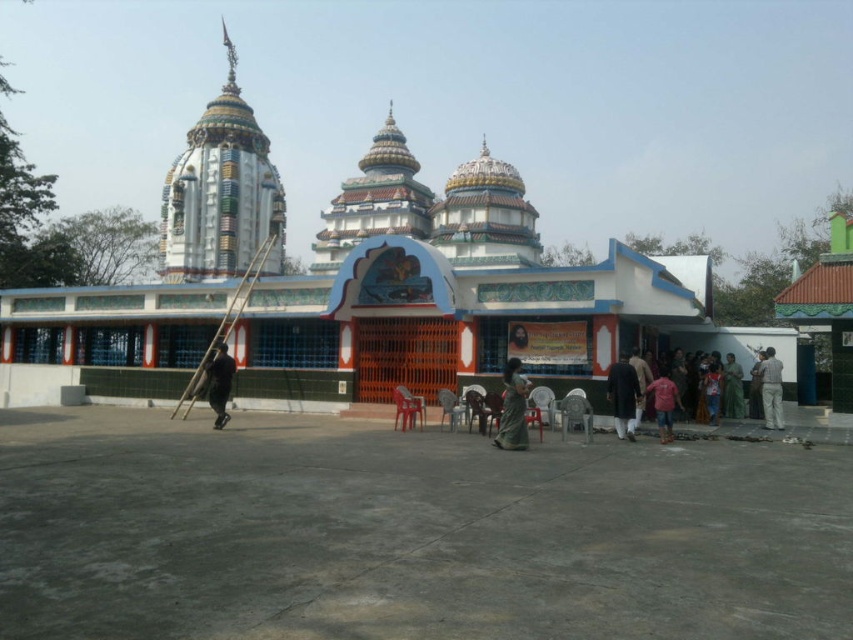
You are a visitor at the temple complex and notice two fabrics displayed in the courtyard. The dark brown fabric at center and the dark blue fabric at center. Which fabric is positioned lower in relation to the other?

The dark brown fabric at center is below dark blue fabric at center, so the dark brown fabric at center is positioned lower than the dark blue fabric at center.

You are standing in the courtyard of the temple complex and want to place a new decorative item. The temple has a large arched gateway with a painted mural above it. There are several plastic chairs arranged in the courtyard. Where should you place the new item so it aligns with the dark brown fabric at center?

The dark brown fabric at center is located at coordinates point (624, 396), so you should place the new item at that position to align with it.